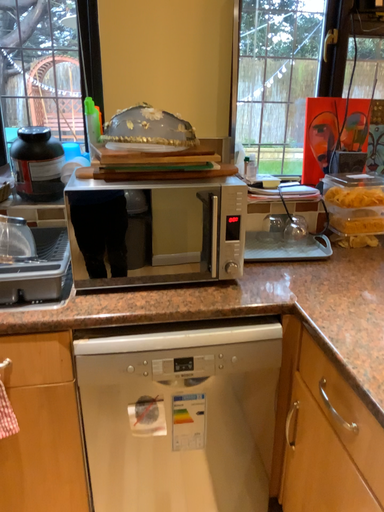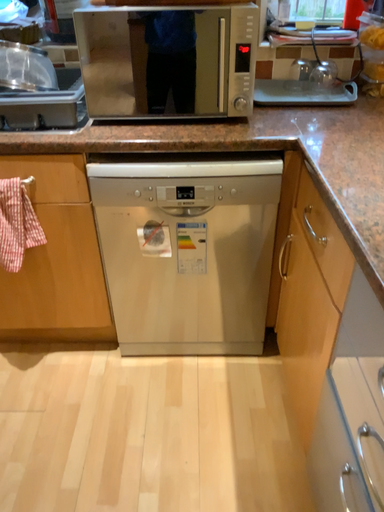
Question: Which way did the camera rotate in the video?

Choices:
 (A) rotated downward
 (B) rotated upward

Answer: (A)